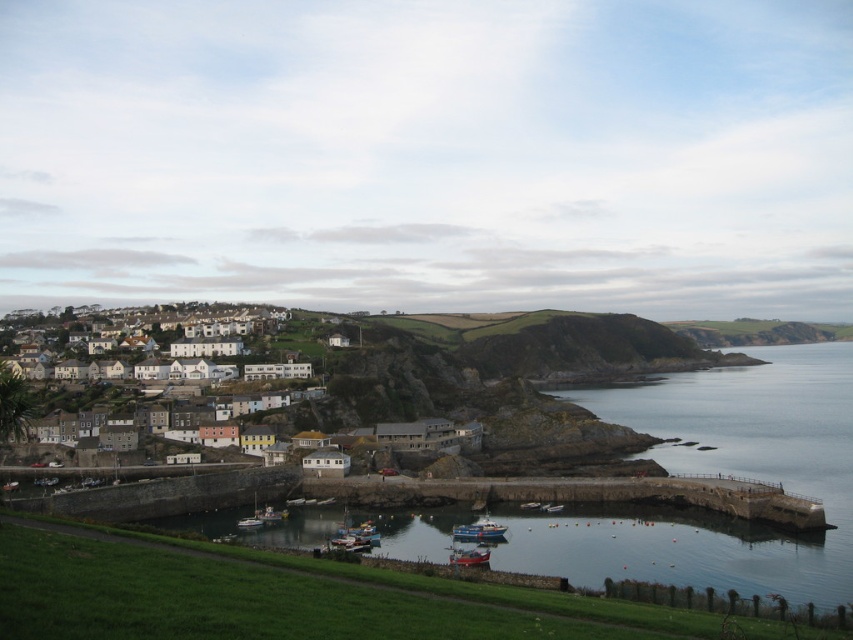
Between white stone houses at left and white plastic boat at lower center, which one has less height?

Standing shorter between the two is white plastic boat at lower center.

Does white stone houses at left have a greater height compared to white plastic boat at lower center?

Correct, white stone houses at left is much taller as white plastic boat at lower center.

Image resolution: width=853 pixels, height=640 pixels. What do you see at coordinates (373, 394) in the screenshot?
I see `white stone houses at left` at bounding box center [373, 394].

Locate an element on the screen. white stone houses at left is located at coordinates (373, 394).

Who is more distant from viewer, (456,538) or (254,512)?

The point (254,512) is behind.

Does blue metallic boat at center come in front of white plastic boat at lower center?

Yes.

You are a GUI agent. You are given a task and a screenshot of the screen. Output one action in this format:
    pyautogui.click(x=<x>, y=<y>)
    Task: Click on the blue metallic boat at center
    The height and width of the screenshot is (640, 853).
    Given the screenshot: What is the action you would take?
    pyautogui.click(x=479, y=531)

Which is more to the left, white stone houses at left or red plastic boat at lower center?

Positioned to the left is white stone houses at left.

Does white stone houses at left appear under red plastic boat at lower center?

Actually, white stone houses at left is above red plastic boat at lower center.

What do you see at coordinates (373, 394) in the screenshot? I see `white stone houses at left` at bounding box center [373, 394].

Locate an element on the screen. white stone houses at left is located at coordinates coord(373,394).